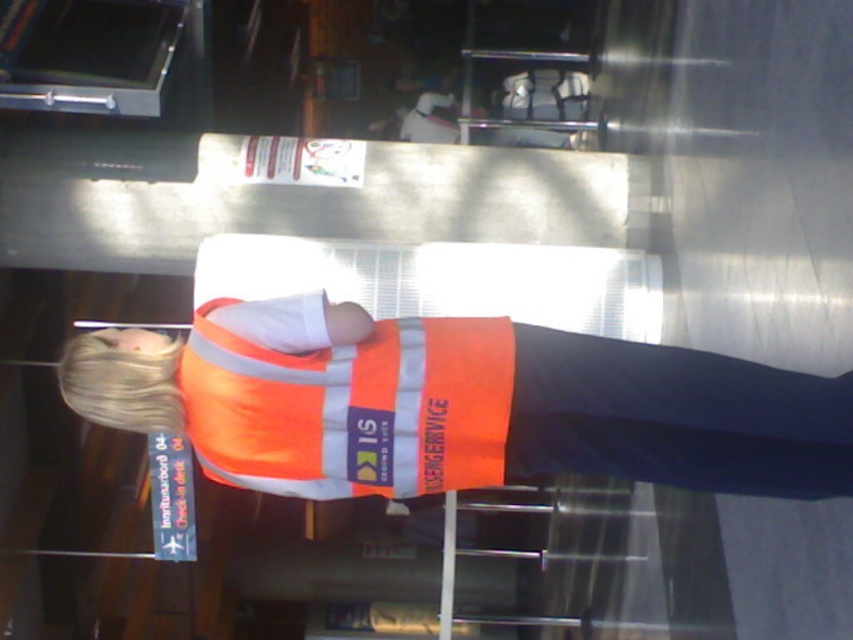
Is reflective orange vest at center to the right of orange reflective vest at center from the viewer's perspective?

Correct, you'll find reflective orange vest at center to the right of orange reflective vest at center.

Can you confirm if reflective orange vest at center is taller than orange reflective vest at center?

No, reflective orange vest at center is not taller than orange reflective vest at center.

Is point (601, 451) farther from viewer compared to point (297, 467)?

Yes, it is.

You are a GUI agent. You are given a task and a screenshot of the screen. Output one action in this format:
    pyautogui.click(x=<x>, y=<y>)
    Task: Click on the reflective orange vest at center
    The image size is (853, 640).
    Given the screenshot: What is the action you would take?
    pyautogui.click(x=456, y=404)